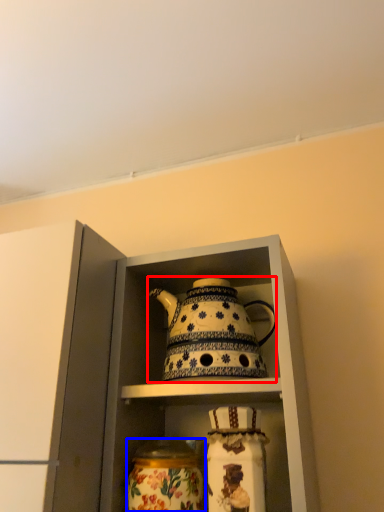
Question: Among these objects, which one is nearest to the camera, kettle (highlighted by a red box) or glass vase (highlighted by a blue box)?

Choices:
 (A) kettle
 (B) glass vase

Answer: (B)